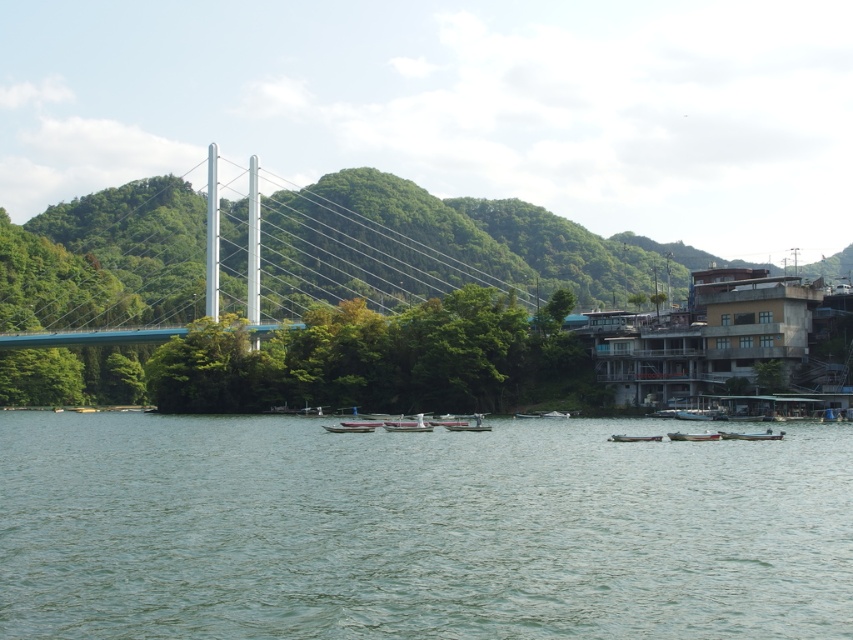
Question: Can you confirm if green water at center is bigger than blue metallic suspension bridge at center?

Choices:
 (A) yes
 (B) no

Answer: (B)

Question: Which object is positioned closest to the metallic silver boat at lower right?

Choices:
 (A) wooden boat at center
 (B) white plastic boat at center

Answer: (A)

Question: Which object is closer to the camera taking this photo?

Choices:
 (A) wooden boat at lower right
 (B) wooden boat at center

Answer: (B)

Question: Which object is positioned farthest from the metallic silver boat at lower right?

Choices:
 (A) wooden boat at lower right
 (B) blue metallic suspension bridge at center
 (C) wooden boat at center

Answer: (B)

Question: Does white plastic boat at center have a greater width compared to metallic silver boat at lower right?

Choices:
 (A) no
 (B) yes

Answer: (B)

Question: Does green water at center lie behind wooden boat at lower right?

Choices:
 (A) yes
 (B) no

Answer: (B)